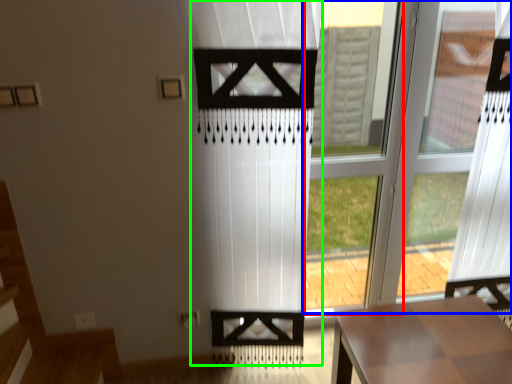
Question: Which object is positioned closest to window frame (highlighted by a red box)? Select from window (highlighted by a blue box) and curtain (highlighted by a green box).

Choices:
 (A) window
 (B) curtain

Answer: (A)